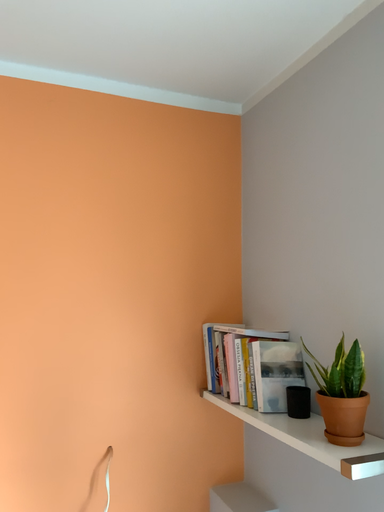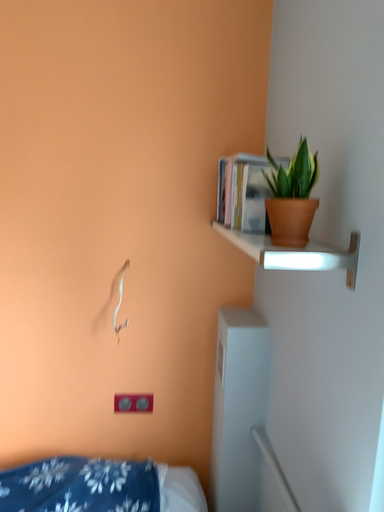
Question: How did the camera likely rotate when shooting the video?

Choices:
 (A) rotated upward
 (B) rotated downward

Answer: (B)